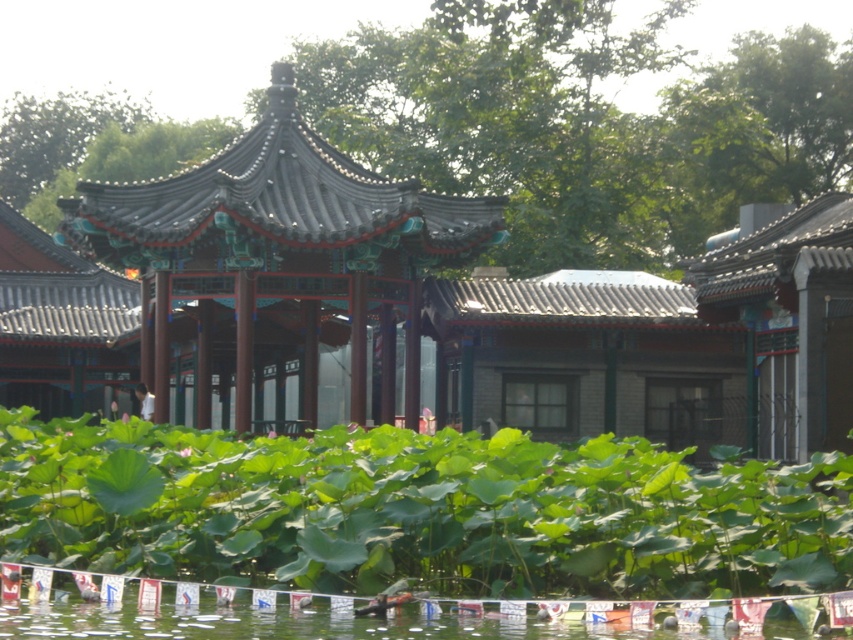
Question: Is green leafy plants at center wider than shiny dark gray gazebo at center?

Choices:
 (A) no
 (B) yes

Answer: (B)

Question: Is green leafy plants at center further to camera compared to shiny dark gray gazebo at center?

Choices:
 (A) yes
 (B) no

Answer: (B)

Question: Is green leafy plants at center positioned in front of shiny dark gray gazebo at center?

Choices:
 (A) yes
 (B) no

Answer: (A)